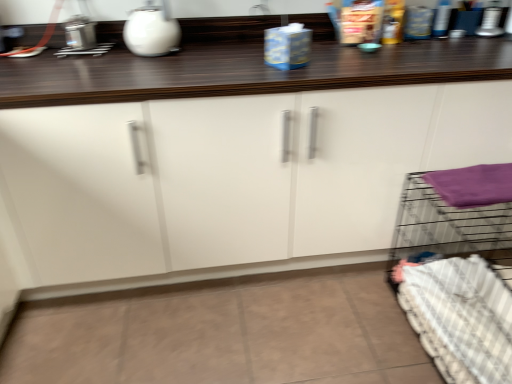
Question: Does white checkered bedding at lower right appear on the right side of purple fabric at right?

Choices:
 (A) yes
 (B) no

Answer: (A)

Question: Could you tell me if white checkered bedding at lower right is facing purple fabric at right?

Choices:
 (A) no
 (B) yes

Answer: (A)

Question: From the image's perspective, is white checkered bedding at lower right over purple fabric at right?

Choices:
 (A) no
 (B) yes

Answer: (A)

Question: Considering the relative sizes of white checkered bedding at lower right and purple fabric at right in the image provided, is white checkered bedding at lower right wider than purple fabric at right?

Choices:
 (A) yes
 (B) no

Answer: (A)

Question: From a real-world perspective, is white checkered bedding at lower right physically above purple fabric at right?

Choices:
 (A) no
 (B) yes

Answer: (A)

Question: Considering the positions of point (x=234, y=264) and point (x=479, y=183), is point (x=234, y=264) closer or farther from the camera than point (x=479, y=183)?

Choices:
 (A) farther
 (B) closer

Answer: (A)

Question: From the image's perspective, is white glossy cabinet at center positioned above or below purple fabric at right?

Choices:
 (A) above
 (B) below

Answer: (A)

Question: Looking at their shapes, would you say white glossy cabinet at center is wider or thinner than purple fabric at right?

Choices:
 (A) wide
 (B) thin

Answer: (A)

Question: From a real-world perspective, is white glossy cabinet at center physically located above or below purple fabric at right?

Choices:
 (A) below
 (B) above

Answer: (A)

Question: From a real-world perspective, is white checkered bedding at lower right positioned above or below purple fabric at right?

Choices:
 (A) above
 (B) below

Answer: (B)

Question: Looking at their shapes, would you say white checkered bedding at lower right is wider or thinner than purple fabric at right?

Choices:
 (A) wide
 (B) thin

Answer: (A)

Question: Looking at the image, does white checkered bedding at lower right seem bigger or smaller compared to purple fabric at right?

Choices:
 (A) small
 (B) big

Answer: (B)

Question: Relative to purple fabric at right, is white checkered bedding at lower right in front or behind?

Choices:
 (A) behind
 (B) front

Answer: (B)

Question: From a real-world perspective, is purple fabric at right positioned above or below white glossy cabinet at center?

Choices:
 (A) above
 (B) below

Answer: (A)

Question: From the image's perspective, is purple fabric at right located above or below white glossy cabinet at center?

Choices:
 (A) above
 (B) below

Answer: (B)